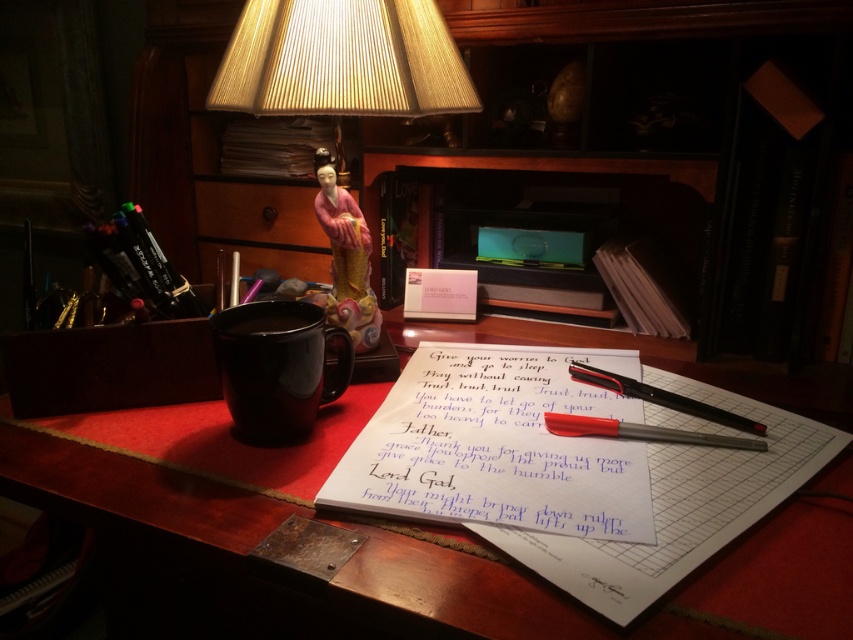
Question: Among these points, which one is nearest to the camera?

Choices:
 (A) (613, 570)
 (B) (573, 362)
 (C) (601, 388)

Answer: (A)

Question: Which object appears farthest from the camera in this image?

Choices:
 (A) white paper notebook at center
 (B) wooden bookshelf at upper center
 (C) matte black mug at center

Answer: (B)

Question: Can you confirm if smooth wooden table at center is thinner than wooden bookshelf at upper center?

Choices:
 (A) yes
 (B) no

Answer: (B)

Question: Among these objects, which one is nearest to the camera?

Choices:
 (A) matte red pencil at center
 (B) wooden bookshelf at upper center
 (C) white paper with handwritten text at center

Answer: (C)

Question: Does smooth wooden table at center appear under wooden bookshelf at upper center?

Choices:
 (A) yes
 (B) no

Answer: (A)

Question: Considering the relative positions of wooden bookshelf at upper center and white paper with handwritten text at center in the image provided, where is wooden bookshelf at upper center located with respect to white paper with handwritten text at center?

Choices:
 (A) below
 (B) above

Answer: (B)